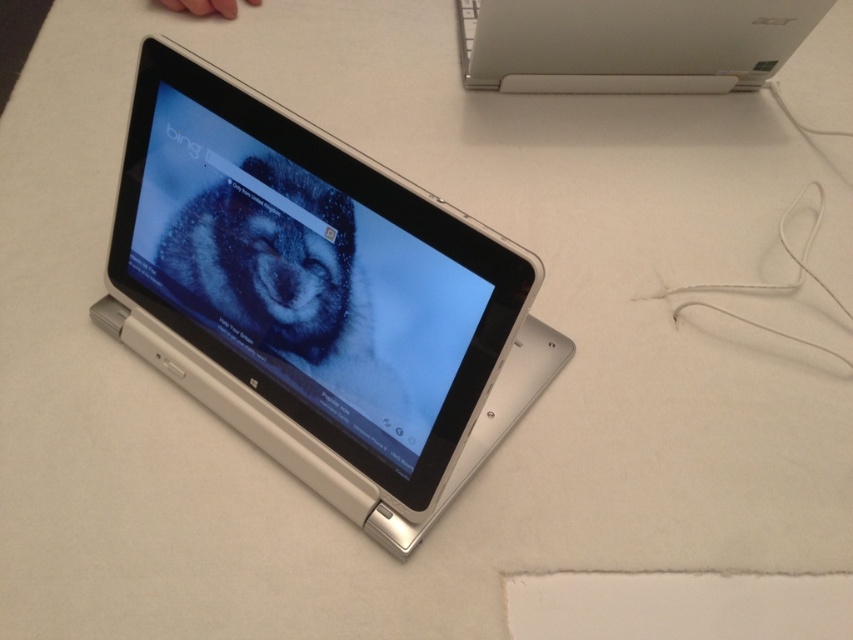
Is white plastic tablet at center above white plastic laptop at upper center?

No, white plastic tablet at center is not above white plastic laptop at upper center.

Which is behind, point (264, 275) or point (596, 4)?

The point (596, 4) is behind.

This screenshot has width=853, height=640. In order to click on white plastic tablet at center in this screenshot , I will do `click(306, 285)`.

Find the location of a particular element. The width and height of the screenshot is (853, 640). white plastic tablet at center is located at coordinates (306, 285).